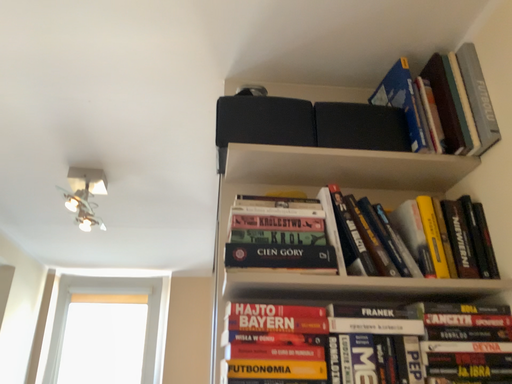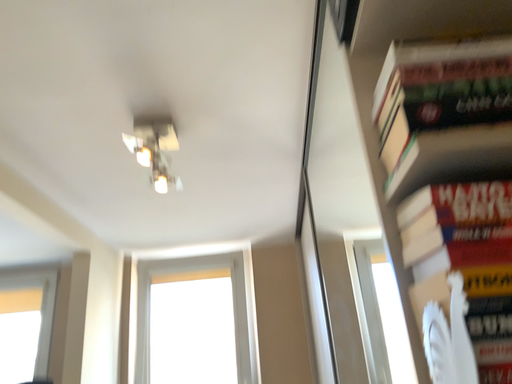
Question: Which way did the camera rotate in the video?

Choices:
 (A) rotated right
 (B) rotated left

Answer: (B)